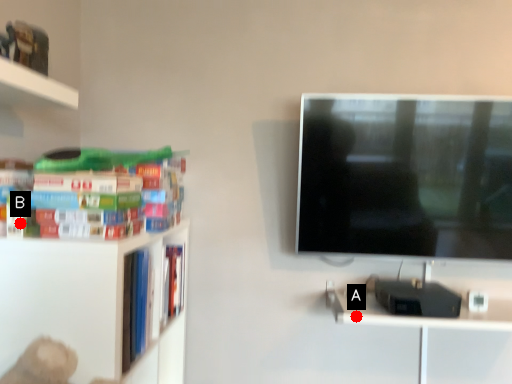
Question: Two points are circled on the image, labeled by A and B beside each circle. Among these points, which one is farthest from the camera?

Choices:
 (A) A is further
 (B) B is further

Answer: (A)